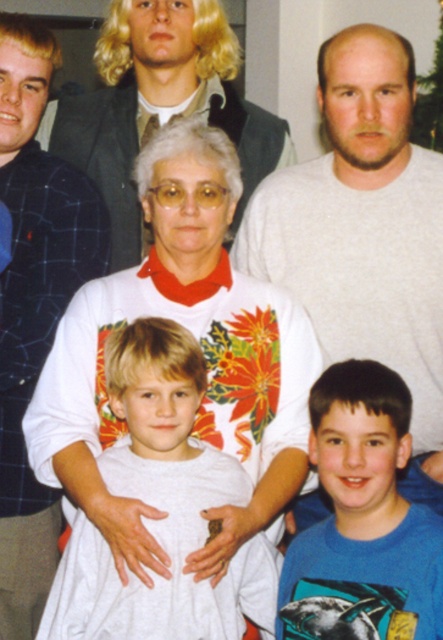
Question: Does blue plaid shirt at left appear under blue printed t-shirt at lower right?

Choices:
 (A) yes
 (B) no

Answer: (B)

Question: Observing the image, what is the correct spatial positioning of blue plaid shirt at left in reference to blue printed t-shirt at lower right?

Choices:
 (A) right
 (B) left

Answer: (B)

Question: Which point is closer to the camera taking this photo?

Choices:
 (A) (307, 515)
 (B) (136, 74)

Answer: (A)

Question: Which of the following is the farthest from the observer?

Choices:
 (A) (407, 573)
 (B) (198, 522)
 (C) (0, 92)
 (D) (120, 241)

Answer: (D)

Question: Which is farther from the white cotton shirt at center?

Choices:
 (A) white matte shirt at upper center
 (B) blue plaid shirt at left
 (C) blue printed t-shirt at lower right

Answer: (A)

Question: Considering the relative positions of blue plaid shirt at left and matte gray suit at upper center in the image provided, where is blue plaid shirt at left located with respect to matte gray suit at upper center?

Choices:
 (A) below
 (B) above

Answer: (A)